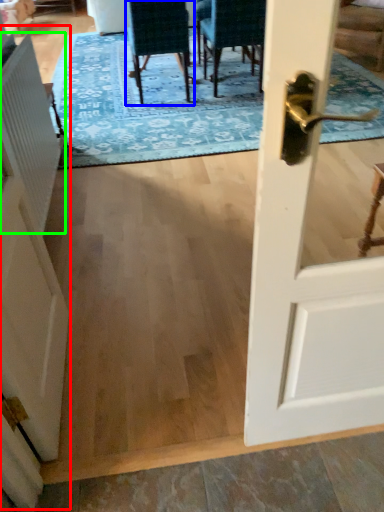
Question: Based on their relative distances, which object is nearer to barn door (highlighted by a red box)? Choose from chair (highlighted by a blue box) and radiator (highlighted by a green box).

Choices:
 (A) chair
 (B) radiator

Answer: (B)